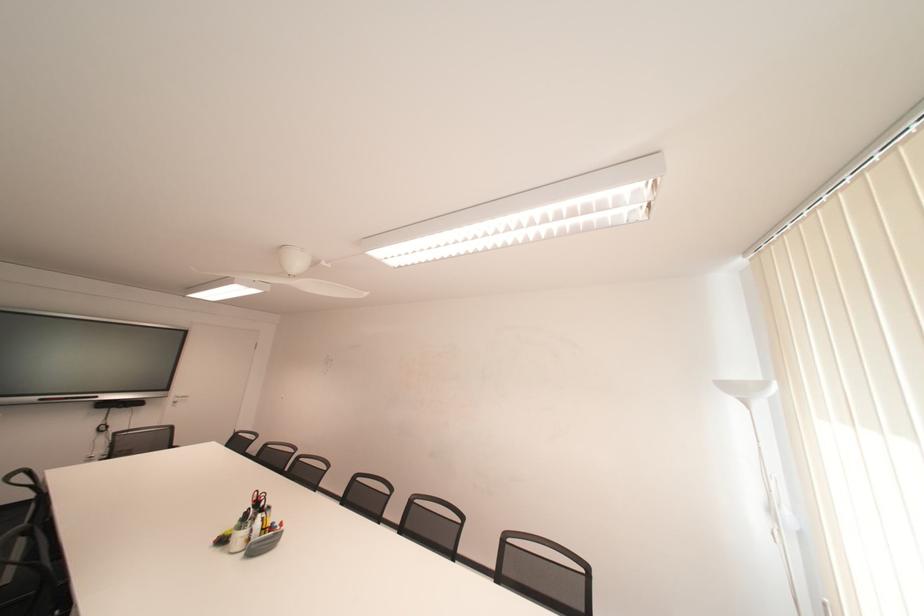
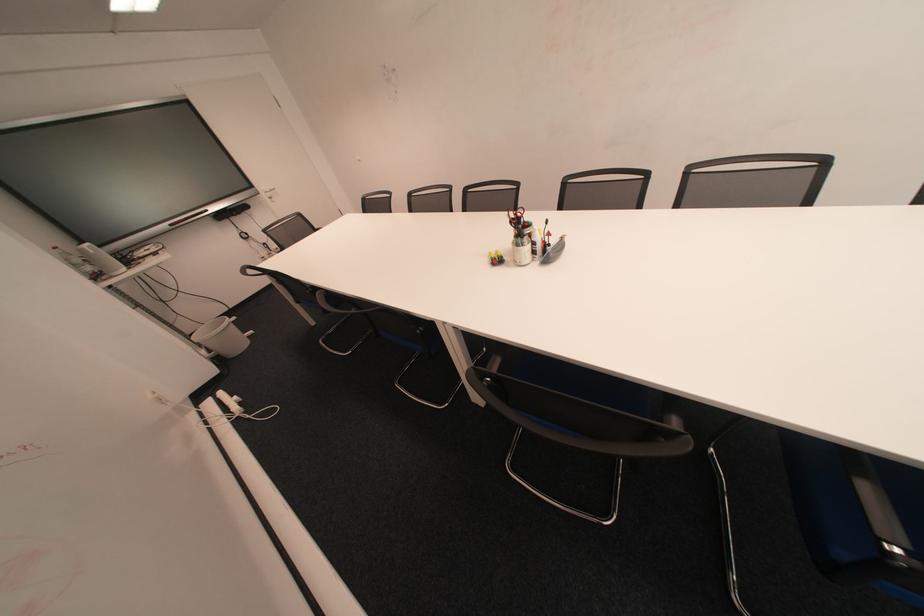
Find the pixel in the second image that matches (250,529) in the first image.

(529, 245)